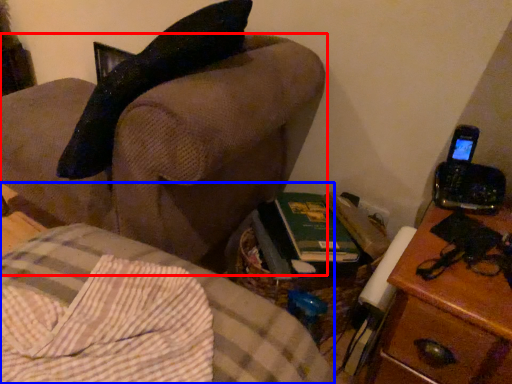
Question: Which of the following is the farthest to the observer, furniture (highlighted by a red box) or furniture (highlighted by a blue box)?

Choices:
 (A) furniture
 (B) furniture

Answer: (A)